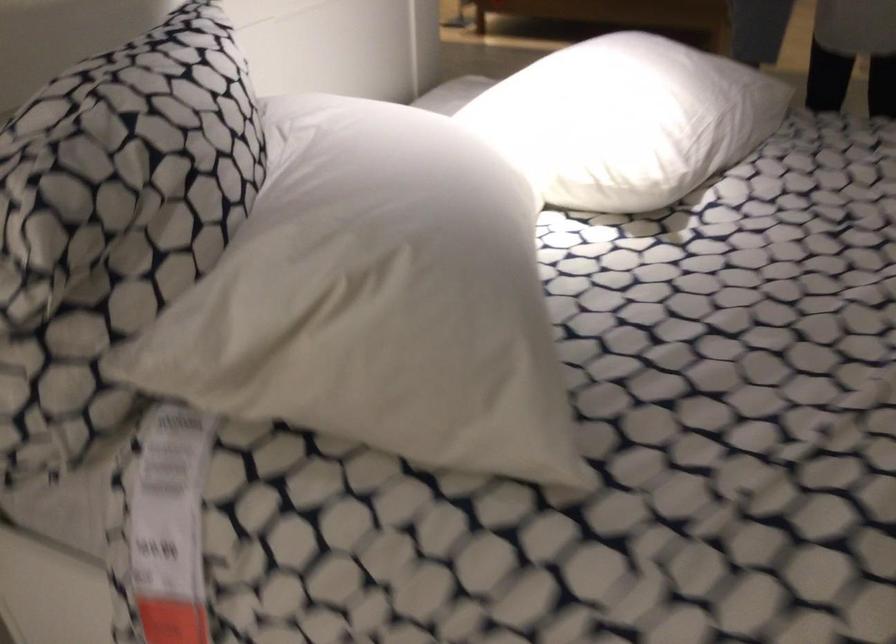
Where would you lift the white pillow? Please return your answer as a coordinate pair (x, y).

(574, 46)